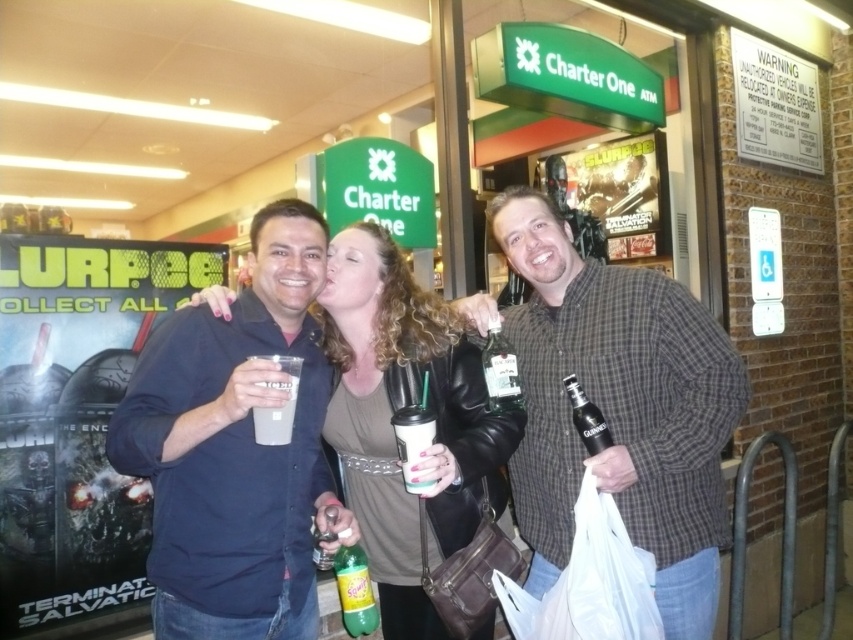
Can you confirm if white plastic bag at lower right is smaller than white matte cup at center?

Actually, white plastic bag at lower right might be larger than white matte cup at center.

Can you confirm if white plastic bag at lower right is positioned below white matte cup at center?

Yes, white plastic bag at lower right is below white matte cup at center.

In order to click on white plastic bag at lower right in this screenshot , I will do `click(589, 582)`.

Identify the location of white plastic bag at lower right. This screenshot has width=853, height=640. (589, 582).

Does checkered fabric shirt at center appear on the left side of green matte soda bottle at center?

Incorrect, checkered fabric shirt at center is not on the left side of green matte soda bottle at center.

Between point (680, 612) and point (358, 598), which one is positioned in front?

Point (358, 598) is in front.

The image size is (853, 640). Find the location of `checkered fabric shirt at center`. checkered fabric shirt at center is located at coordinates (619, 408).

Between white plastic bag at lower right and green matte soda bottle at center, which one has more height?

white plastic bag at lower right is taller.

The height and width of the screenshot is (640, 853). Describe the element at coordinates (589, 582) in the screenshot. I see `white plastic bag at lower right` at that location.

Who is more forward, (543, 634) or (363, 595)?

Point (543, 634) is in front.

This screenshot has height=640, width=853. Find the location of `white plastic bag at lower right`. white plastic bag at lower right is located at coordinates (589, 582).